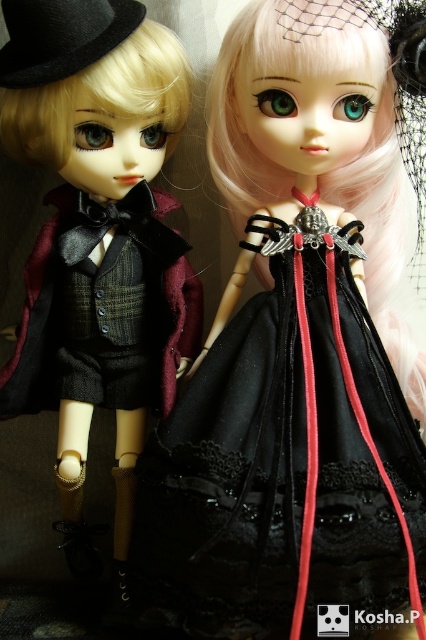
Image resolution: width=426 pixels, height=640 pixels. What do you see at coordinates (36, 321) in the screenshot?
I see `plaid wool vest at center` at bounding box center [36, 321].

Which is more to the right, plaid wool vest at center or black felt hat at upper left?

plaid wool vest at center

From the picture: Measure the distance between point (17, 412) and camera.

They are 37.31 inches apart.

Locate an element on the screen. This screenshot has width=426, height=640. plaid wool vest at center is located at coordinates (36, 321).

Is point (270, 422) closer to camera compared to point (23, 29)?

No, it is not.

Between matte black dress at center and black felt hat at upper left, which one has less height?

Standing shorter between the two is black felt hat at upper left.

Does point (311, 172) lie in front of point (31, 60)?

No, it is not.

The image size is (426, 640). What are the coordinates of `matte black dress at center` in the screenshot? It's located at (301, 342).

Who is more forward, (65, 0) or (31, 6)?

Point (65, 0)

Between matte black coat at left and black felt hat at upper left, which one appears on the left side from the viewer's perspective?

black felt hat at upper left is more to the left.

Describe the element at coordinates (98, 228) in the screenshot. This screenshot has height=640, width=426. I see `matte black coat at left` at that location.

Find the location of a particular element. Image resolution: width=426 pixels, height=640 pixels. matte black coat at left is located at coordinates (98, 228).